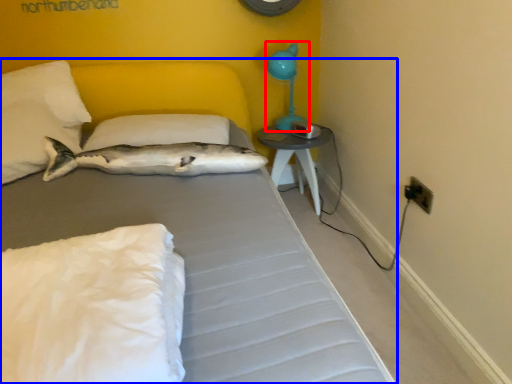
Question: Which point is further to the camera, table lamp (highlighted by a red box) or bed (highlighted by a blue box)?

Choices:
 (A) table lamp
 (B) bed

Answer: (A)